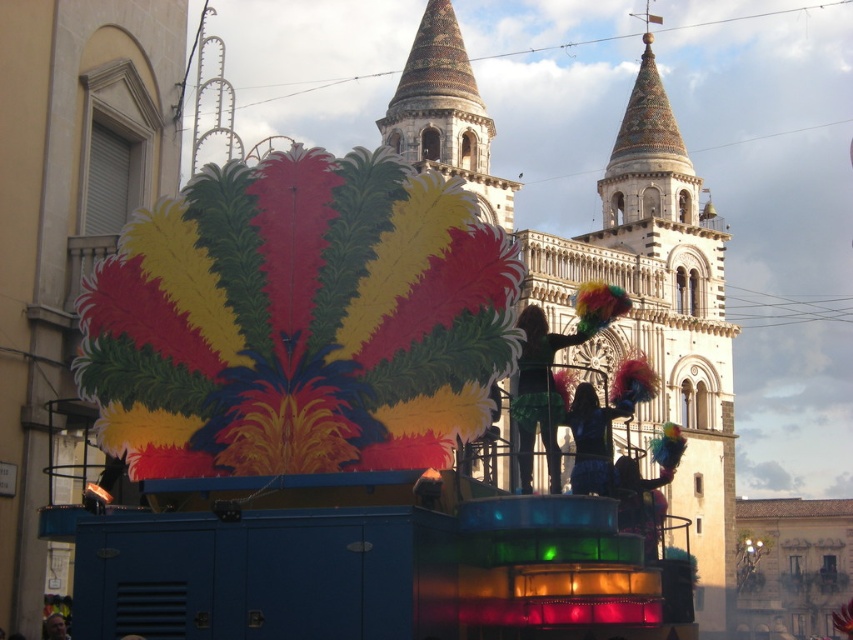
You are a photographer taking pictures of the speckled stone tower at center and the multicolored feathers at center. Which object is positioned higher in the image?

The speckled stone tower at center is positioned higher than the multicolored feathers at center in the image.

You are a photographer standing in the middle of the parade. You notice the speckled stone tower at center and the smooth skin face at center in your viewfinder. Which object is blocking the view of the other?

The speckled stone tower at center is positioned over the smooth skin face at center, so the tower is blocking the view of the face.

You are a photographer trying to capture the speckled stone tower at center and the multicolored feathers at center in the same frame. Based on their positions, which object should you adjust your camera to focus on first to ensure both are in the shot?

Since the speckled stone tower at center is to the left of the multicolored feathers at center, you should focus on the multicolored feathers at center first as it is positioned further to the right, allowing you to frame both objects by adjusting from right to left.